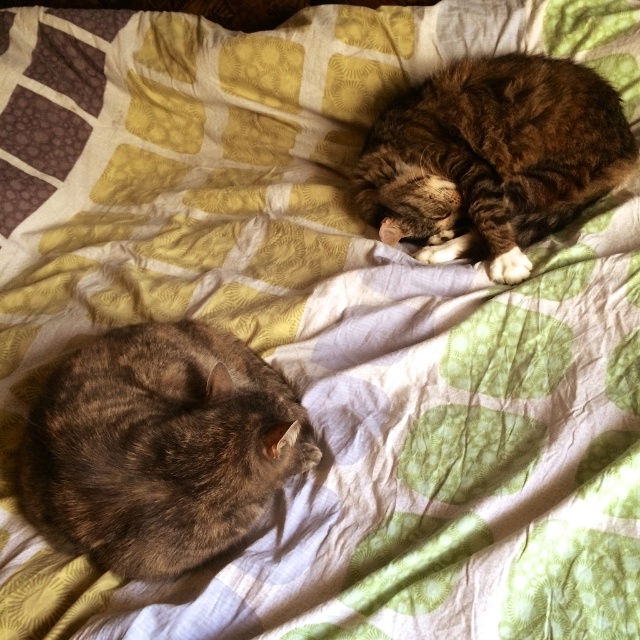
You are a photographer trying to capture both cats in a single shot. Since the gray fur cat at lower left is smaller than the tabby fur cat at upper right, which cat should you focus on first to ensure both are in frame?

The gray fur cat at lower left is not as tall as the tabby fur cat at upper right, so you should focus on the tabby fur cat at upper right first to ensure both are in frame.

You are looking at the image of two cats on a bed. There are two points marked in the image. The first point is at coordinate point (179, 390) and the second is at point (497, 138). Which of these two points is closer to you?

Point (179, 390) is closer to the viewer than point (497, 138).

You are a cat owner who wants to place a small toy between the two cats so that it is equally distant from both. Given that the gray fur cat at lower left and the tabby fur cat at upper right are 65.09 centimeters apart, where should you place the toy?

Place the toy exactly halfway between the gray fur cat at lower left and the tabby fur cat at upper right. Since they are 65.09 centimeters apart, the toy should be placed at 32.545 centimeters from each cat to ensure equal distance.